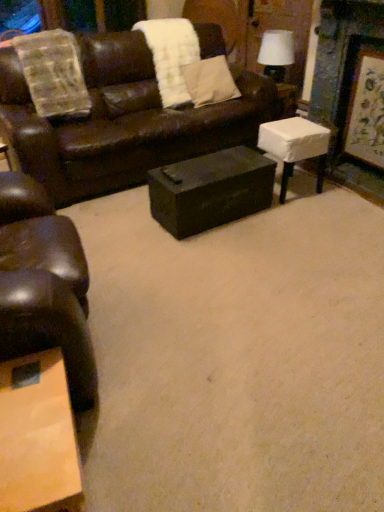
Identify the location of empty space that is ontop of matte black trunk at center, the second table when ordered from right to left (from a real-world perspective). (207, 169).